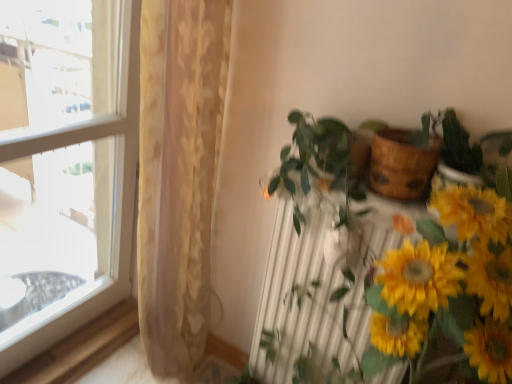
Question: Could you tell me if yellow matte sunflowers at lower right is facing wooden at upper right?

Choices:
 (A) yes
 (B) no

Answer: (B)

Question: Is yellow matte sunflowers at lower right taller than wooden at upper right?

Choices:
 (A) yes
 (B) no

Answer: (A)

Question: Is yellow matte sunflowers at lower right closer to camera compared to wooden at upper right?

Choices:
 (A) yes
 (B) no

Answer: (A)

Question: Does yellow matte sunflowers at lower right have a lesser height compared to wooden at upper right?

Choices:
 (A) yes
 (B) no

Answer: (B)

Question: Does yellow matte sunflowers at lower right come behind wooden at upper right?

Choices:
 (A) no
 (B) yes

Answer: (A)

Question: Does yellow matte sunflowers at lower right appear on the left side of wooden at upper right?

Choices:
 (A) no
 (B) yes

Answer: (A)

Question: From the image's perspective, is green glossy plant at center located beneath transparent glass window at left?

Choices:
 (A) no
 (B) yes

Answer: (B)

Question: From a real-world perspective, is green glossy plant at center below transparent glass window at left?

Choices:
 (A) yes
 (B) no

Answer: (A)

Question: From a real-world perspective, does green glossy plant at center stand above transparent glass window at left?

Choices:
 (A) no
 (B) yes

Answer: (A)

Question: Is green glossy plant at center outside of transparent glass window at left?

Choices:
 (A) yes
 (B) no

Answer: (A)

Question: Is green glossy plant at center wider than transparent glass window at left?

Choices:
 (A) no
 (B) yes

Answer: (B)

Question: Is green glossy plant at center in contact with transparent glass window at left?

Choices:
 (A) yes
 (B) no

Answer: (B)

Question: Is wooden at upper right outside green glossy plant at center?

Choices:
 (A) no
 (B) yes

Answer: (B)